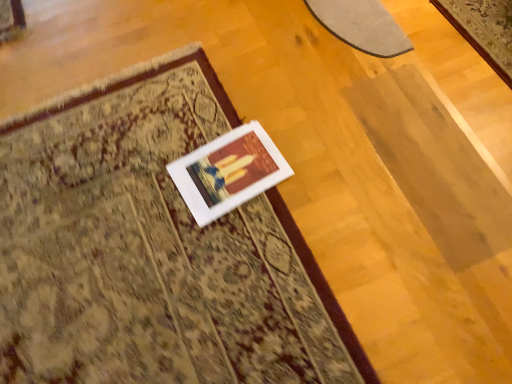
Question: Considering the relative positions of beige carpet at center, positioned as the first mat in front-to-back order, and matte gray rug at upper right, the second mat when ordered from front to back, in the image provided, is beige carpet at center, positioned as the first mat in front-to-back order, in front of matte gray rug at upper right, the second mat when ordered from front to back,?

Choices:
 (A) no
 (B) yes

Answer: (B)

Question: Is beige carpet at center, acting as the 2th mat starting from the back, with matte gray rug at upper right, the first mat in the back-to-front sequence?

Choices:
 (A) no
 (B) yes

Answer: (A)

Question: From a real-world perspective, is beige carpet at center, which ranks as the 1th mat in left-to-right order, over matte gray rug at upper right, the second mat when ordered from front to back?

Choices:
 (A) no
 (B) yes

Answer: (B)

Question: Can you confirm if beige carpet at center, which is the 2th mat from right to left, is shorter than matte gray rug at upper right, which is counted as the second mat, starting from the bottom?

Choices:
 (A) no
 (B) yes

Answer: (B)

Question: From the image's perspective, would you say beige carpet at center, positioned as the first mat in front-to-back order, is shown under matte gray rug at upper right, placed as the 2th mat when sorted from left to right?

Choices:
 (A) no
 (B) yes

Answer: (B)

Question: From a real-world perspective, does beige carpet at center, which is the 2th mat from right to left, sit lower than matte gray rug at upper right, which ranks as the first mat in top-to-bottom order?

Choices:
 (A) no
 (B) yes

Answer: (A)

Question: Can you confirm if white matte picture frame at center is thinner than matte gray rug at upper right, which ranks as the first mat in top-to-bottom order?

Choices:
 (A) yes
 (B) no

Answer: (B)

Question: Could you tell me if white matte picture frame at center is turned towards matte gray rug at upper right, which is counted as the second mat, starting from the bottom?

Choices:
 (A) yes
 (B) no

Answer: (B)

Question: Does white matte picture frame at center come in front of matte gray rug at upper right, which ranks as the first mat in top-to-bottom order?

Choices:
 (A) yes
 (B) no

Answer: (A)

Question: Does white matte picture frame at center lie behind matte gray rug at upper right, the first mat in the back-to-front sequence?

Choices:
 (A) yes
 (B) no

Answer: (B)

Question: From a real-world perspective, is white matte picture frame at center physically above matte gray rug at upper right, which ranks as the first mat in top-to-bottom order?

Choices:
 (A) yes
 (B) no

Answer: (A)

Question: Is white matte picture frame at center to the left of matte gray rug at upper right, which is counted as the second mat, starting from the bottom, from the viewer's perspective?

Choices:
 (A) yes
 (B) no

Answer: (A)

Question: Is matte gray rug at upper right, placed as the 2th mat when sorted from left to right, oriented away from beige carpet at center, positioned as the first mat in front-to-back order?

Choices:
 (A) yes
 (B) no

Answer: (B)